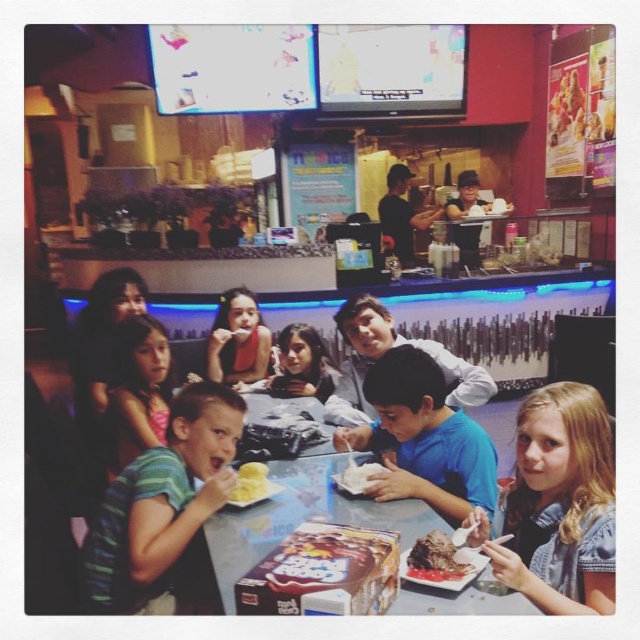
You are a customer in the ice cream shop and want to place your order. You see two points in the scene, point (396, 234) and point (252, 468). Which point is closer to you?

Point (396, 234) is further to the viewer than point (252, 468), so the closer point to you is point (252, 468).

You are a photographer trying to capture a candid shot of the light brown hair at lower right and the striped cotton shirt at lower left. Since you want to focus on both subjects clearly, which one should you adjust your camera focus to prioritize based on their positions?

The light brown hair at lower right is shorter than striped cotton shirt at lower left, so you should prioritize focusing on the light brown hair at lower right first since it is closer to the camera.

Consider the image. You are a customer in the ice cream shop and want to place your phone on the table. You see the black cap at center and the white fluffy cake at lower center. Which object should you avoid placing your phone near to ensure it doesn

You should avoid placing your phone near the white fluffy cake at lower center because the black cap at center is above it and might block access or cause instability.